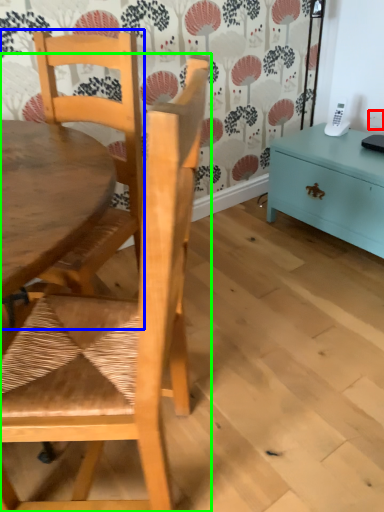
Question: Based on their relative distances, which object is farther from power outlet (highlighted by a red box)? Choose from chair (highlighted by a blue box) and chair (highlighted by a green box).

Choices:
 (A) chair
 (B) chair

Answer: (B)